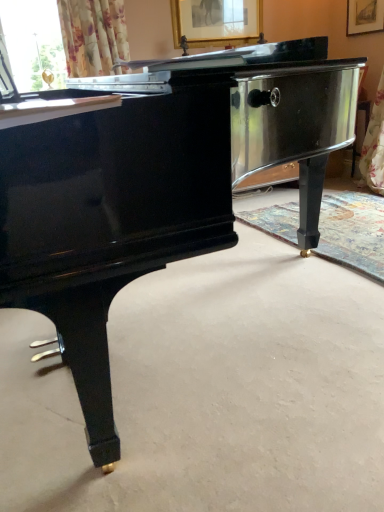
The height and width of the screenshot is (512, 384). I want to click on gold metallic piano leg at center, so click(353, 231).

Describe the element at coordinates (353, 231) in the screenshot. The width and height of the screenshot is (384, 512). I see `gold metallic piano leg at center` at that location.

The image size is (384, 512). What do you see at coordinates (216, 22) in the screenshot? I see `gold-framed picture at upper center` at bounding box center [216, 22].

You are a GUI agent. You are given a task and a screenshot of the screen. Output one action in this format:
    pyautogui.click(x=<x>, y=<y>)
    Task: Click on the gold-framed picture at upper center
    The image size is (384, 512).
    Given the screenshot: What is the action you would take?
    pyautogui.click(x=216, y=22)

Measure the distance between gold-framed picture at upper center and camera.

A distance of 3.23 meters exists between gold-framed picture at upper center and camera.

Image resolution: width=384 pixels, height=512 pixels. What are the coordinates of `gold metallic piano leg at center` in the screenshot? It's located at (353, 231).

Considering the relative positions of gold-framed picture at upper center and gold metallic piano leg at center in the image provided, is gold-framed picture at upper center to the left or to the right of gold metallic piano leg at center?

In the image, gold-framed picture at upper center appears on the left side of gold metallic piano leg at center.

Considering the positions of objects gold-framed picture at upper center and gold metallic piano leg at center in the image provided, who is behind, gold-framed picture at upper center or gold metallic piano leg at center?

gold-framed picture at upper center is further from the camera.

Considering the points (189, 40) and (346, 221), which point is in front, point (189, 40) or point (346, 221)?

The point (346, 221) is in front.

Based on the photo, from the image's perspective, is gold-framed picture at upper center above or below gold metallic piano leg at center?

Based on their image positions, gold-framed picture at upper center is located above gold metallic piano leg at center.

From a real-world perspective, is gold-framed picture at upper center on top of gold metallic piano leg at center?

Yes.

Does gold-framed picture at upper center have a lesser width compared to gold metallic piano leg at center?

Yes.

Does gold-framed picture at upper center have a lesser height compared to gold metallic piano leg at center?

No.

Considering the sizes of gold-framed picture at upper center and gold metallic piano leg at center in the image, is gold-framed picture at upper center bigger or smaller than gold metallic piano leg at center?

In the image, gold-framed picture at upper center appears to be smaller than gold metallic piano leg at center.

Is gold-framed picture at upper center spatially inside gold metallic piano leg at center, or outside of it?

The correct answer is: outside.

Looking at this image, can you see gold-framed picture at upper center touching gold metallic piano leg at center?

There is a gap between gold-framed picture at upper center and gold metallic piano leg at center.

Is gold-framed picture at upper center facing away from gold metallic piano leg at center?

gold-framed picture at upper center does not have its back to gold metallic piano leg at center.

The height and width of the screenshot is (512, 384). I want to click on picture frame located behind the gold metallic piano leg at center, so click(x=216, y=22).

Which object is positioned more to the right, gold metallic piano leg at center or gold-framed picture at upper center?

gold metallic piano leg at center is more to the right.

Who is more distant, gold metallic piano leg at center or gold-framed picture at upper center?

Positioned behind is gold-framed picture at upper center.

Is point (362, 234) farther from viewer compared to point (202, 25)?

No, (362, 234) is closer to viewer.

From the image's perspective, is gold metallic piano leg at center located above or below gold-framed picture at upper center?

gold metallic piano leg at center is below gold-framed picture at upper center.

From a real-world perspective, is gold metallic piano leg at center physically below gold-framed picture at upper center?

Yes, from a real-world perspective, gold metallic piano leg at center is below gold-framed picture at upper center.

Can you confirm if gold metallic piano leg at center is wider than gold-framed picture at upper center?

Correct, the width of gold metallic piano leg at center exceeds that of gold-framed picture at upper center.

Does gold metallic piano leg at center have a lesser height compared to gold-framed picture at upper center?

Correct, gold metallic piano leg at center is not as tall as gold-framed picture at upper center.

Who is smaller, gold metallic piano leg at center or gold-framed picture at upper center?

gold-framed picture at upper center is smaller.

Would you say gold metallic piano leg at center is outside gold-framed picture at upper center?

Yes.

Are gold metallic piano leg at center and gold-framed picture at upper center located far from each other?

Yes, gold metallic piano leg at center and gold-framed picture at upper center are quite far apart.

Is gold metallic piano leg at center oriented towards gold-framed picture at upper center?

No, gold metallic piano leg at center is not facing towards gold-framed picture at upper center.

How distant is gold metallic piano leg at center from gold-framed picture at upper center?

gold metallic piano leg at center is 1.70 meters away from gold-framed picture at upper center.

Find the location of a particular element. picture frame above the gold metallic piano leg at center (from the image's perspective) is located at coordinates (216, 22).

This screenshot has width=384, height=512. I want to click on picture frame lying on the left of gold metallic piano leg at center, so click(216, 22).

Where is `picture frame lying behind the gold metallic piano leg at center`? Image resolution: width=384 pixels, height=512 pixels. picture frame lying behind the gold metallic piano leg at center is located at coordinates (216, 22).